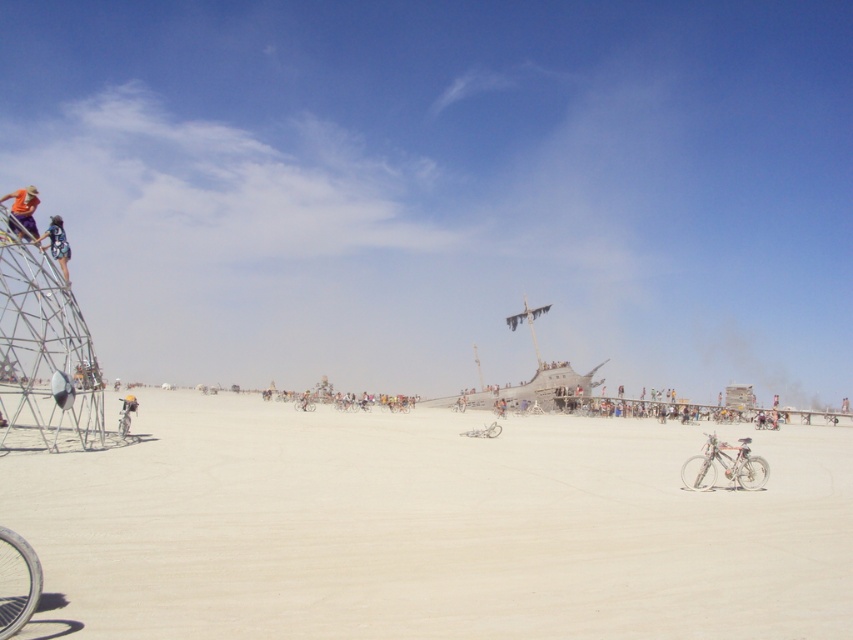
You are an artist planning to photograph the silver metallic bicycle at lower left and the metallic silver bicycle at center. To ensure both are visible in the frame, should you adjust your camera angle upwards or downwards?

The silver metallic bicycle at lower left is positioned over the metallic silver bicycle at center, so you should adjust your camera angle downwards to ensure both are visible in the frame.

You are planning to ride the silver metallic bicycle at lower left towards the white sand dirt track at center. Which direction should you head?

The white sand dirt track at center is to the right of the silver metallic bicycle at lower left, so you should head right to reach it.

What is the exact coordinate of the white sand dirt track at center?

The white sand dirt track at center is located at point (x=428, y=528).